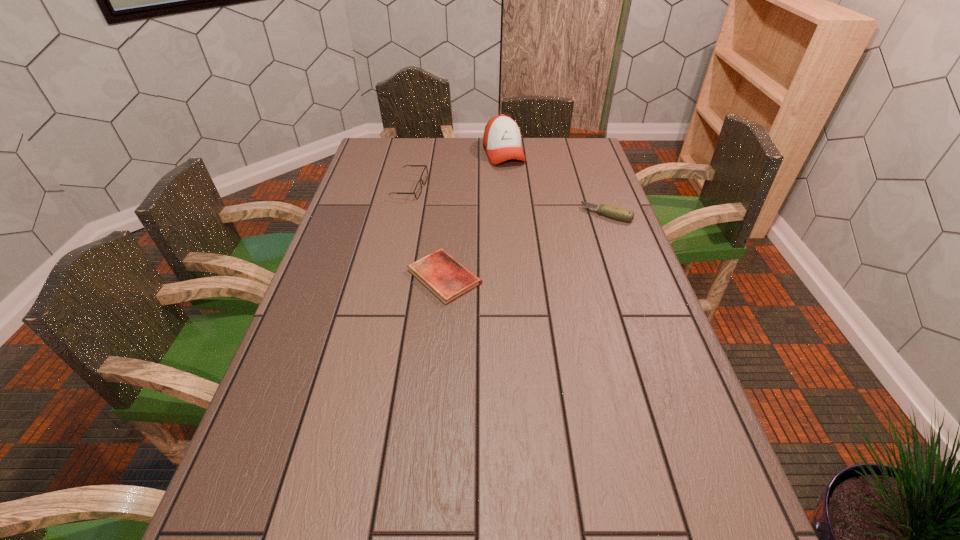
Where is `the shortest object`? The width and height of the screenshot is (960, 540). the shortest object is located at coordinates (439, 272).

You are a GUI agent. You are given a task and a screenshot of the screen. Output one action in this format:
    pyautogui.click(x=<x>, y=<y>)
    Task: Click on the nearest object
    
    Given the screenshot: What is the action you would take?
    pyautogui.click(x=439, y=272)

The height and width of the screenshot is (540, 960). I want to click on the rightmost object, so click(x=614, y=212).

You are a GUI agent. You are given a task and a screenshot of the screen. Output one action in this format:
    pyautogui.click(x=<x>, y=<y>)
    Task: Click on the pocketknife
    
    Given the screenshot: What is the action you would take?
    pyautogui.click(x=614, y=212)

Image resolution: width=960 pixels, height=540 pixels. Identify the location of the second object from right to left. (502, 138).

Where is `baseball cap`? baseball cap is located at coordinates (502, 138).

At what (x,y) coordinates should I click in order to perform the action: click on the second farthest object. Please return your answer as a coordinate pair (x, y). This screenshot has width=960, height=540. Looking at the image, I should click on (418, 189).

You are a GUI agent. You are given a task and a screenshot of the screen. Output one action in this format:
    pyautogui.click(x=<x>, y=<y>)
    Task: Click on the second tallest object
    
    Given the screenshot: What is the action you would take?
    pyautogui.click(x=418, y=189)

Identify the location of vacant space located on the back of the shortest object. The width and height of the screenshot is (960, 540). (447, 240).

Image resolution: width=960 pixels, height=540 pixels. I want to click on vacant space located on the back of the second nearest object, so click(597, 188).